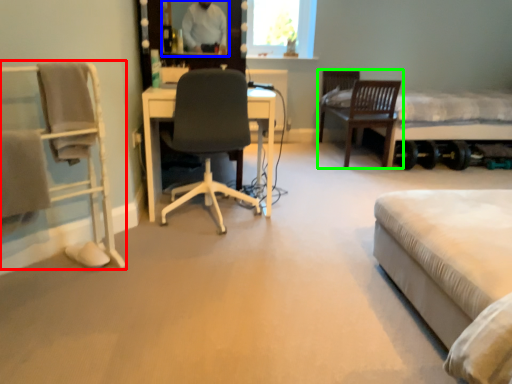
Question: Which object is positioned closest to chair (highlighted by a red box)? Select from mirror (highlighted by a blue box) and chair (highlighted by a green box).

Choices:
 (A) mirror
 (B) chair

Answer: (A)